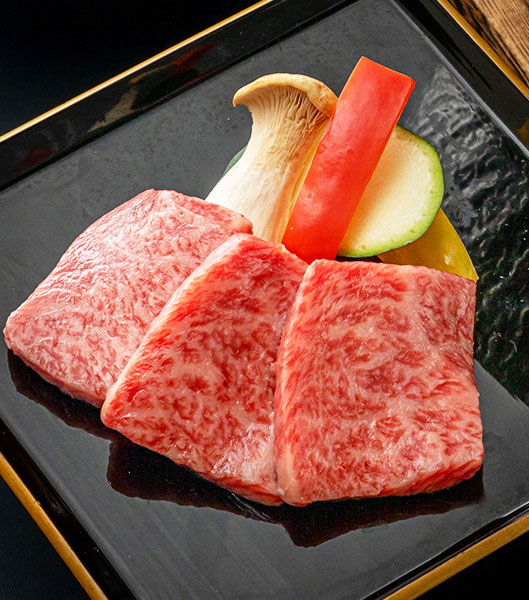
Locate an element on the screen. The width and height of the screenshot is (529, 600). edge of plate is located at coordinates (187, 68), (61, 521), (500, 85).